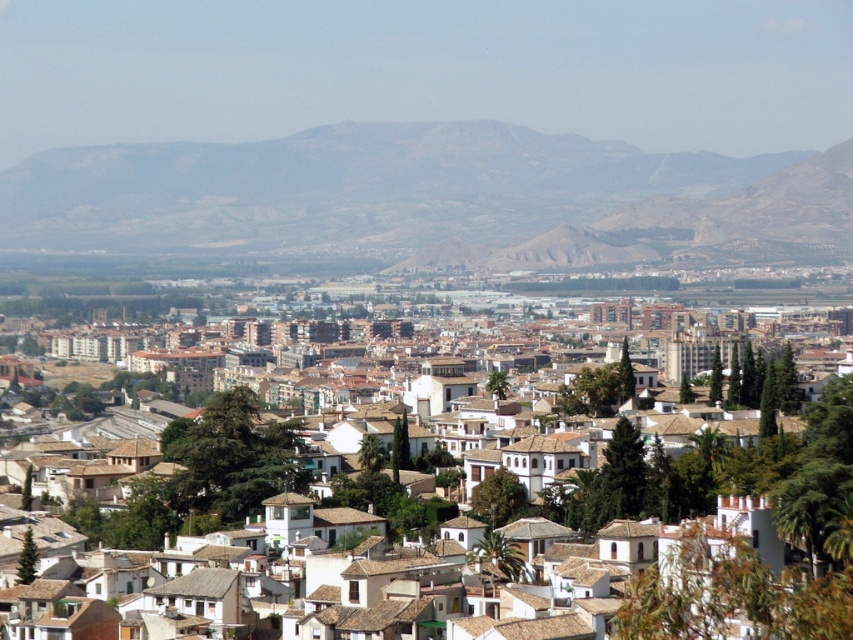
Based on the photo, is white clay buildings at center closer to the viewer compared to rugged brown hillside at center?

That is True.

Who is lower down, white clay buildings at center or rugged brown hillside at center?

Positioned lower is white clay buildings at center.

Is point (695, 508) farther from viewer compared to point (792, 252)?

That is False.

Locate an element on the screen. The image size is (853, 640). white clay buildings at center is located at coordinates (741, 477).

Between gray rocky mountain at upper center and rugged brown hillside at center, which one appears on the left side from the viewer's perspective?

From the viewer's perspective, gray rocky mountain at upper center appears more on the left side.

Locate an element on the screen. The height and width of the screenshot is (640, 853). gray rocky mountain at upper center is located at coordinates (428, 196).

Measure the distance between point (642, 195) and camera.

They are 2163.71 feet apart.

The width and height of the screenshot is (853, 640). What are the coordinates of `gray rocky mountain at upper center` in the screenshot? It's located at (428, 196).

Is gray rocky mountain at upper center below white clay buildings at center?

Incorrect, gray rocky mountain at upper center is not positioned below white clay buildings at center.

Between point (403, 240) and point (746, 580), which one is positioned in front?

Point (746, 580) is in front.

Identify the location of gray rocky mountain at upper center. This screenshot has height=640, width=853. (428, 196).